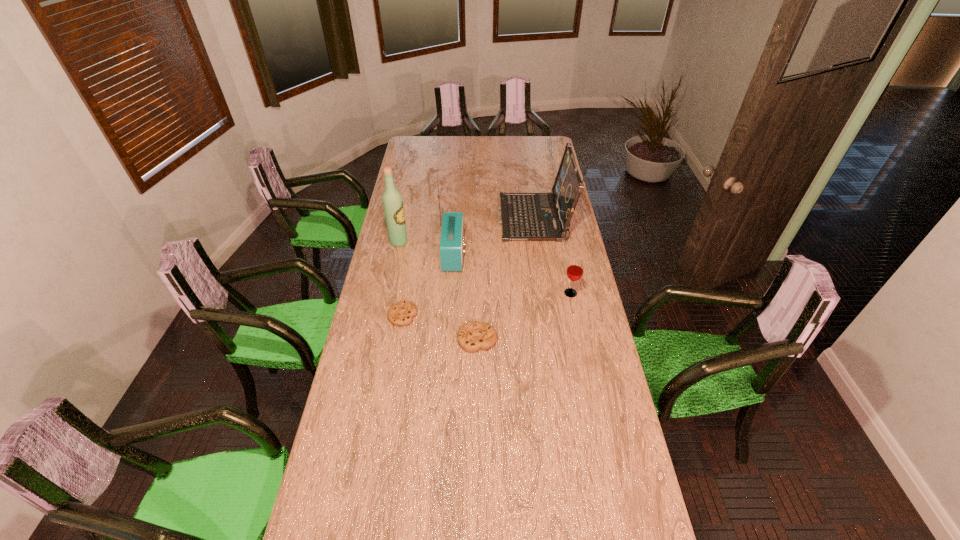
At what (x,y) coordinates should I click in order to perform the action: click on free space located on the back of the taller cookie. Please return your answer as a coordinate pair (x, y). This screenshot has width=960, height=540. Looking at the image, I should click on (477, 307).

The width and height of the screenshot is (960, 540). I want to click on free location located on the front-facing side of the third tallest object, so click(432, 220).

What are the coordinates of `free space located 0.320m on the front-facing side of the third tallest object` in the screenshot? It's located at (434, 220).

Locate an element on the screen. The height and width of the screenshot is (540, 960). free region located 0.200m on the front-facing side of the third tallest object is located at coordinates (458, 220).

Where is `free space located 0.060m on the front-facing side of the wine bottle`? free space located 0.060m on the front-facing side of the wine bottle is located at coordinates (420, 242).

Where is `vacant area situated on the front panel of the radio receiver`? The image size is (960, 540). vacant area situated on the front panel of the radio receiver is located at coordinates (505, 254).

Locate an element on the screen. This screenshot has width=960, height=540. vacant space located 0.350m on the left of the third shortest object is located at coordinates (479, 293).

Where is `cookie located in the left edge section of the desktop`? This screenshot has width=960, height=540. cookie located in the left edge section of the desktop is located at coordinates (401, 314).

You are a GUI agent. You are given a task and a screenshot of the screen. Output one action in this format:
    pyautogui.click(x=<x>, y=<y>)
    Task: Click on the wine bottle that is positioned at the left edge
    The height and width of the screenshot is (540, 960).
    Given the screenshot: What is the action you would take?
    pyautogui.click(x=392, y=201)

Where is `laptop computer that is at the right edge`? laptop computer that is at the right edge is located at coordinates (525, 216).